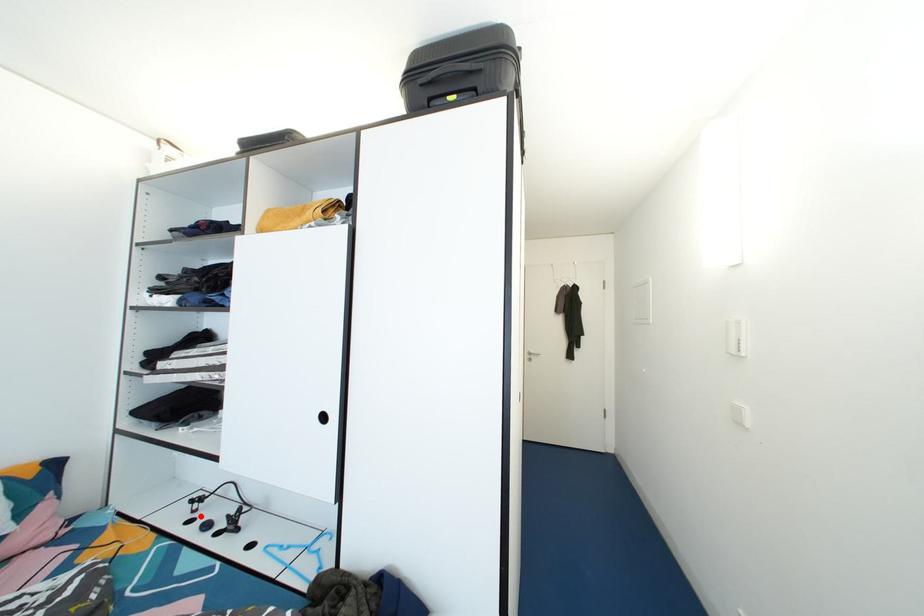
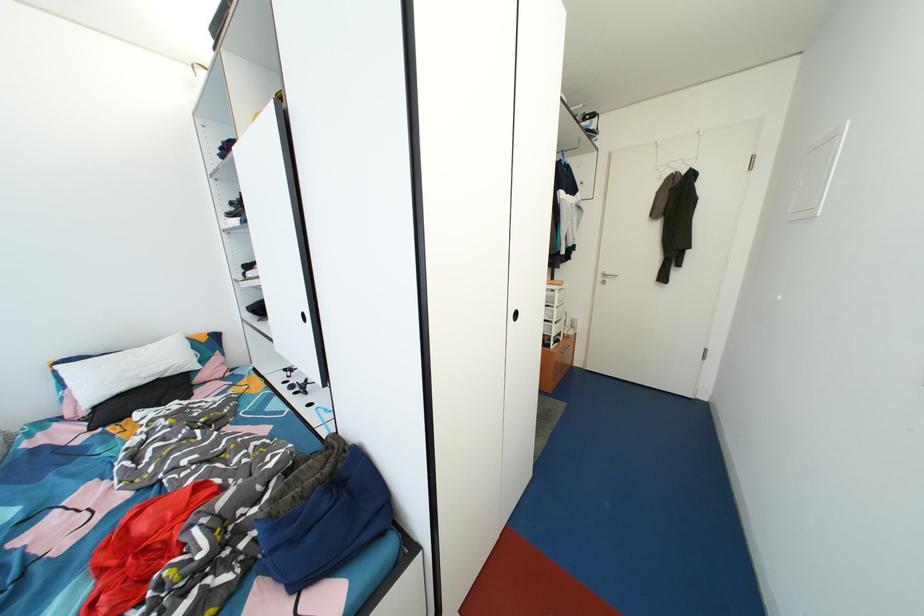
Where in the second image is the point corresponding to the highlighted location from the first image?

(295, 382)